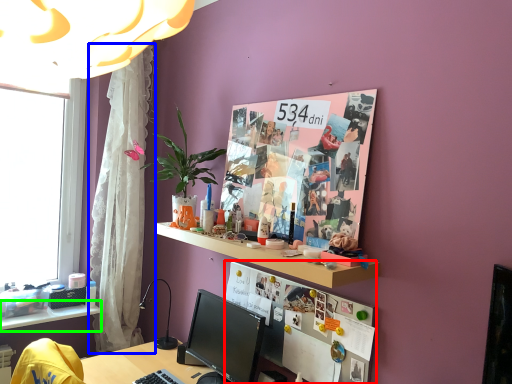
Question: Estimate the real-world distances between objects in this image. Which object is farther from bulletin board (highlighted by a red box), curtain (highlighted by a blue box) or shelf (highlighted by a green box)?

Choices:
 (A) curtain
 (B) shelf

Answer: (B)